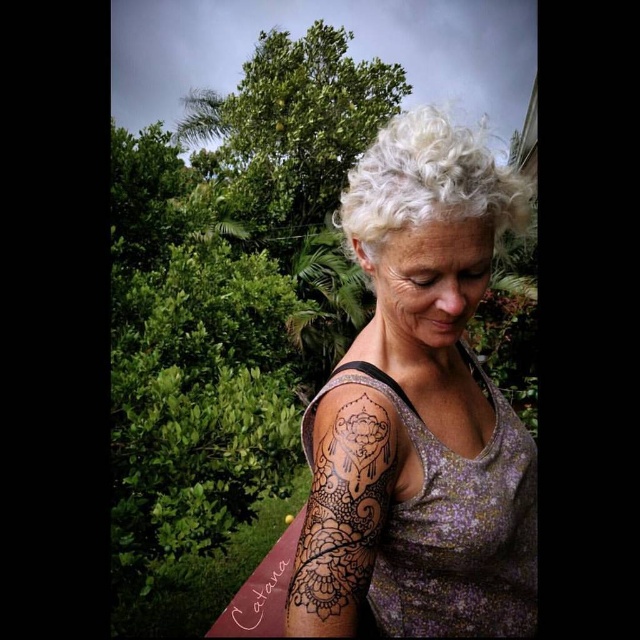
Question: Can you confirm if brown henna tattoo at upper right is thinner than white curly hair at upper center?

Choices:
 (A) yes
 (B) no

Answer: (A)

Question: Which object is farther from the camera taking this photo?

Choices:
 (A) white curly hair at upper center
 (B) brown henna tattoo at upper right
 (C) black henna tattoo at upper right

Answer: (B)

Question: Is black henna tattoo at upper right bigger than white curly hair at upper center?

Choices:
 (A) yes
 (B) no

Answer: (A)

Question: Does black henna tattoo at upper right lie in front of white curly hair at upper center?

Choices:
 (A) yes
 (B) no

Answer: (A)

Question: Estimate the real-world distances between objects in this image. Which object is farther from the white curly hair at upper center?

Choices:
 (A) black henna tattoo at upper right
 (B) brown henna tattoo at upper right

Answer: (B)

Question: Which object is farther from the camera taking this photo?

Choices:
 (A) brown henna tattoo at upper right
 (B) black henna tattoo at upper right
 (C) white curly hair at upper center

Answer: (A)